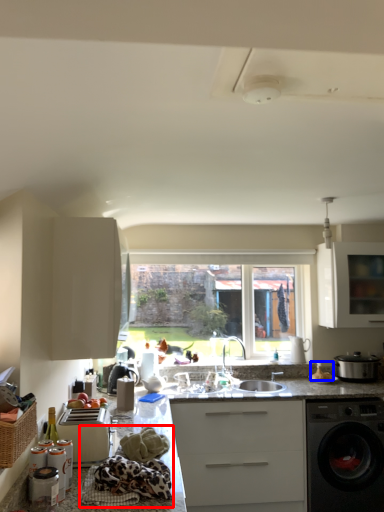
Question: Which object appears farthest to the camera in this image, material (highlighted by a red box) or food (highlighted by a blue box)?

Choices:
 (A) material
 (B) food

Answer: (B)